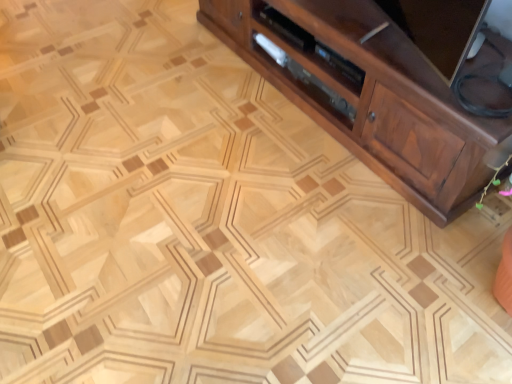
The image size is (512, 384). Find the location of `blank space situated above satin wood drawer at center (from a real-world perspective)`. blank space situated above satin wood drawer at center (from a real-world perspective) is located at coordinates (314, 75).